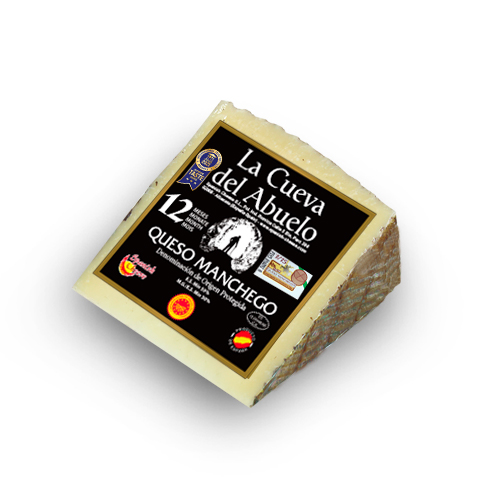
The height and width of the screenshot is (500, 500). Find the location of `door entrance in photo`. door entrance in photo is located at coordinates (245, 249), (221, 233).